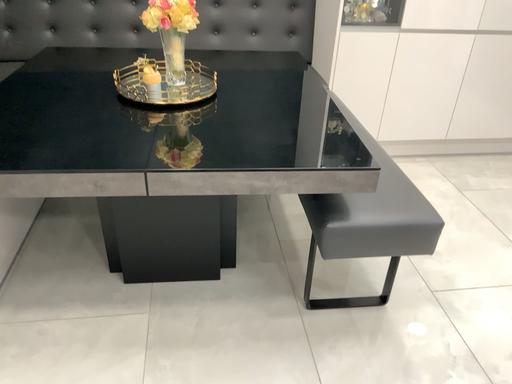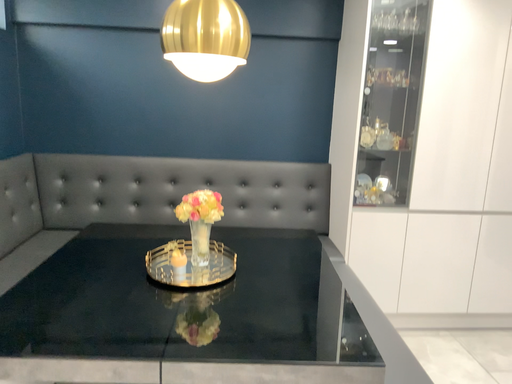
Question: How did the camera likely rotate when shooting the video?

Choices:
 (A) rotated upward
 (B) rotated downward

Answer: (A)